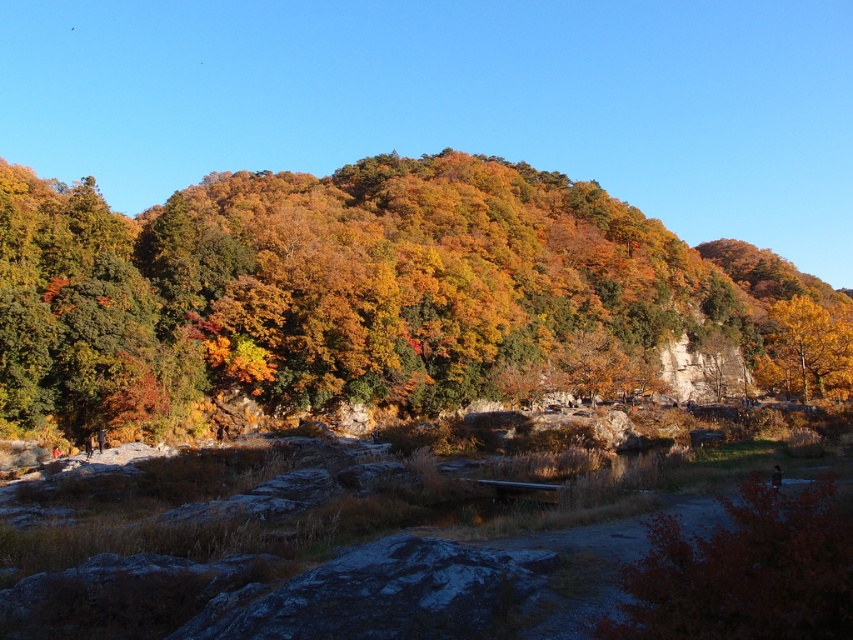
You are an artist painting this autumn scene. You want to ensure that the shiny red bush at lower right and the golden yellow leaves at upper right are proportionally accurate. Which object should you make smaller in your painting?

The shiny red bush at lower right should be made smaller in the painting because it occupies less space than the golden yellow leaves at upper right according to the scene description.

You are standing at the center of the rugged terrain with scattered rocks and dry grass in the foreground of the autumn landscape. You see a point marked at coordinates (744, 572). According to the image, what object is this point located on?

Result: The point at (744, 572) is located on the shiny red bush at lower right.